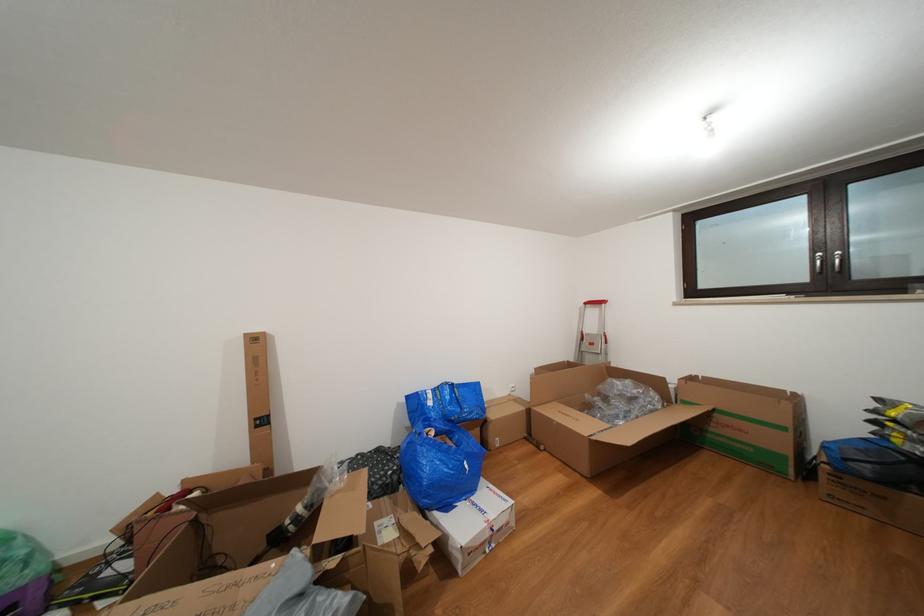
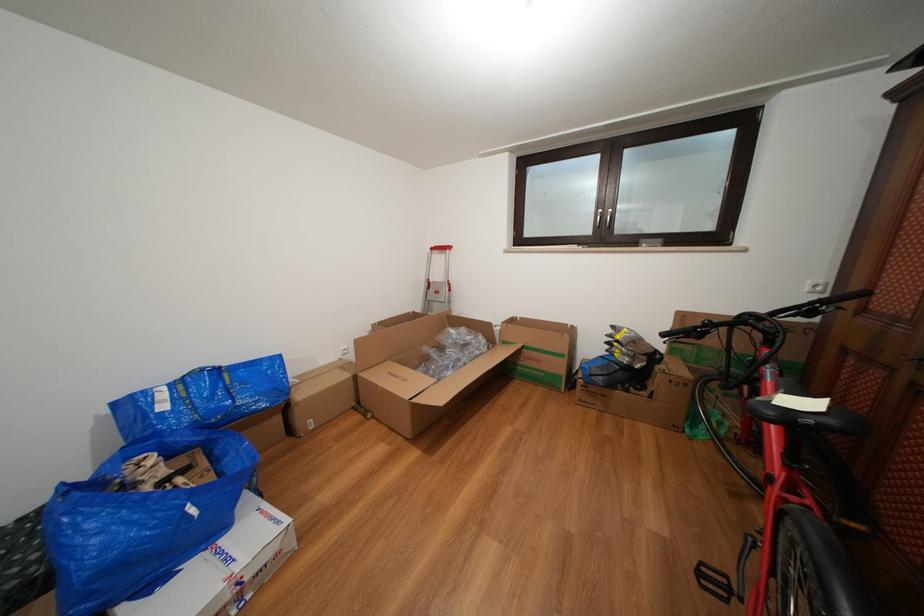
Locate, in the second image, the point that corresponds to point 501,421 in the first image.

(309, 400)